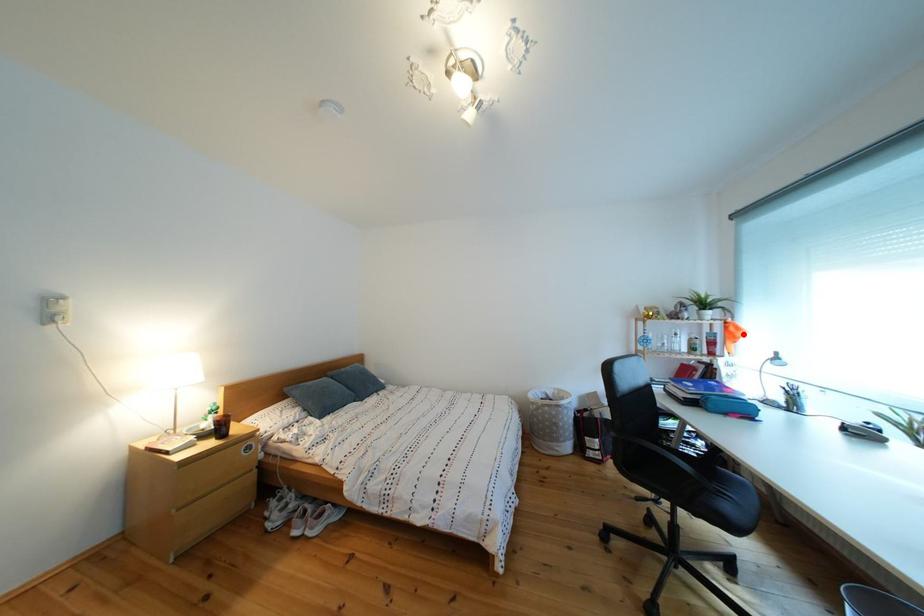
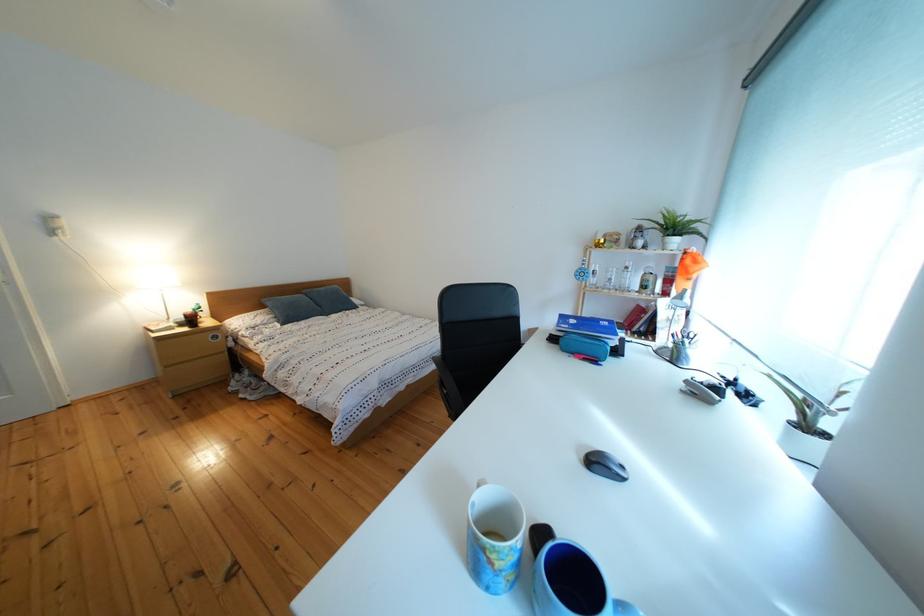
Find the pixel in the second image that matches the highlighted location in the first image.

(699, 267)